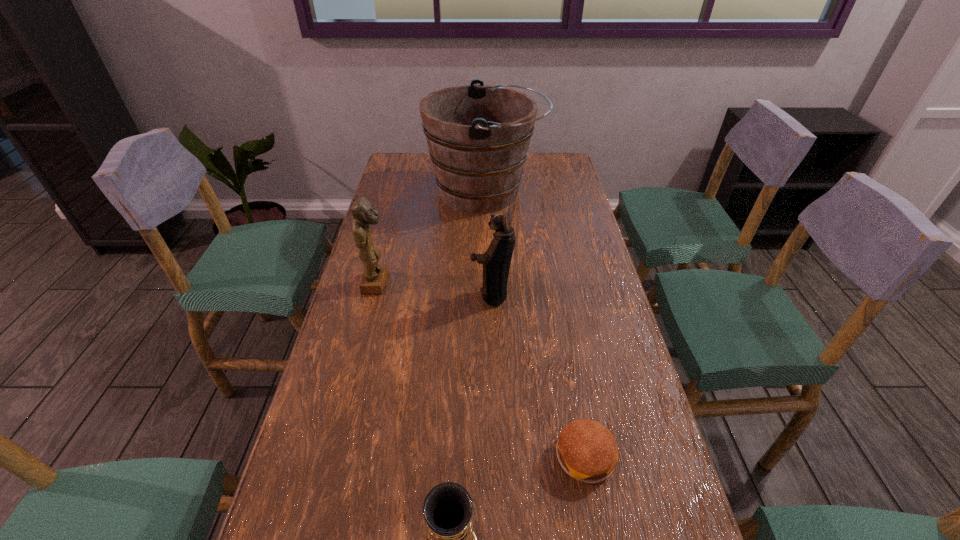
This screenshot has height=540, width=960. What are the coordinates of `vacant space that satisfies the following two spatial constraints: 1. on the front-facing side of the shortest object; 2. on the right side of the right figurine` in the screenshot? It's located at (496, 457).

At what (x,y) coordinates should I click in order to perform the action: click on vacant space that satisfies the following two spatial constraints: 1. on the handle side of the hamburger; 2. on the left side of the farthest object. Please return your answer as a coordinate pair (x, y). This screenshot has width=960, height=540. Looking at the image, I should click on (489, 457).

Where is `vacant space that satisfies the following two spatial constraints: 1. on the front-facing side of the right figurine; 2. on the left side of the fourth farthest object`? The width and height of the screenshot is (960, 540). vacant space that satisfies the following two spatial constraints: 1. on the front-facing side of the right figurine; 2. on the left side of the fourth farthest object is located at coordinates (496, 457).

Locate an element on the screen. Image resolution: width=960 pixels, height=540 pixels. free space that satisfies the following two spatial constraints: 1. on the back side of the second nearest object; 2. on the handle side of the tallest object is located at coordinates (538, 193).

What are the coordinates of `free space that satisfies the following two spatial constraints: 1. on the front-facing side of the shortest object; 2. on the right side of the left figurine` in the screenshot? It's located at (333, 457).